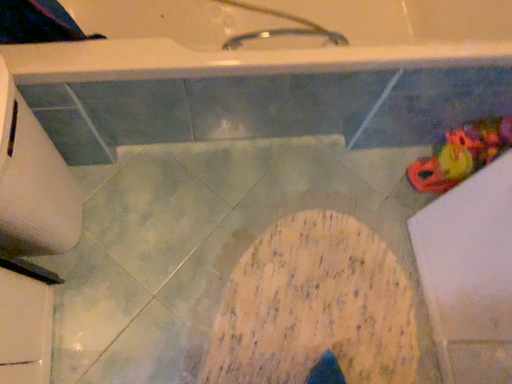
Question: Considering the positions of white matte toilet paper at left and rubber duck at right in the image, is white matte toilet paper at left taller or shorter than rubber duck at right?

Choices:
 (A) short
 (B) tall

Answer: (B)

Question: From the image's perspective, is white matte toilet paper at left positioned above or below rubber duck at right?

Choices:
 (A) above
 (B) below

Answer: (B)

Question: Is white matte toilet paper at left wider or thinner than rubber duck at right?

Choices:
 (A) thin
 (B) wide

Answer: (B)

Question: In the image, is rubber duck at right positioned in front of or behind white matte toilet paper at left?

Choices:
 (A) front
 (B) behind

Answer: (B)

Question: From the image's perspective, is rubber duck at right located above or below white matte toilet paper at left?

Choices:
 (A) below
 (B) above

Answer: (B)

Question: From their relative heights in the image, would you say rubber duck at right is taller or shorter than white matte toilet paper at left?

Choices:
 (A) tall
 (B) short

Answer: (B)

Question: From a real-world perspective, is rubber duck at right above or below white matte toilet paper at left?

Choices:
 (A) above
 (B) below

Answer: (B)